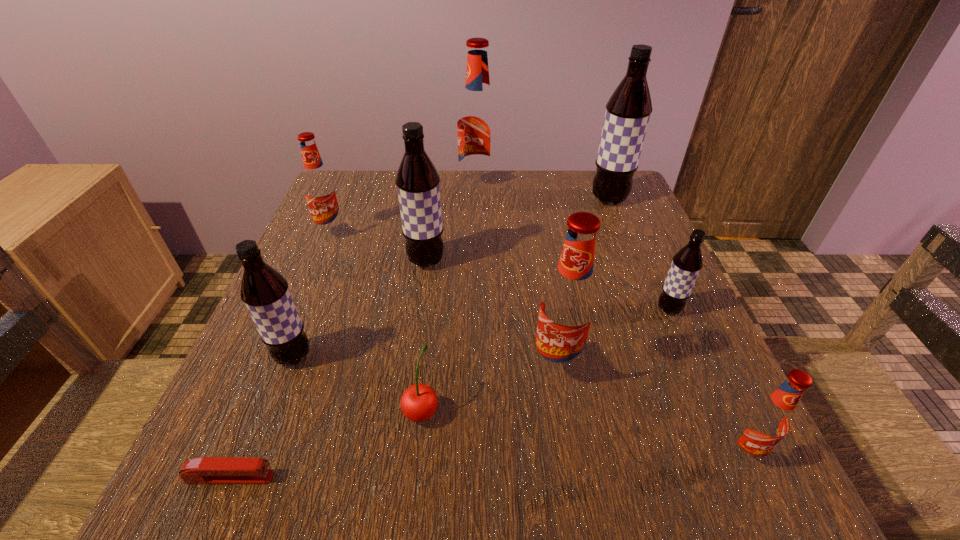
Find the location of `free region located 0.070m on the left of the farthest brown root beer`. free region located 0.070m on the left of the farthest brown root beer is located at coordinates (562, 199).

Identify the location of vacant space located on the back of the third nearest brown root beer. (437, 186).

At what (x,y) coordinates should I click in order to perform the action: click on vacant space located 0.230m on the back of the second biggest red root beer. Please return your answer as a coordinate pair (x, y). Looking at the image, I should click on (540, 263).

You are a GUI agent. You are given a task and a screenshot of the screen. Output one action in this format:
    pyautogui.click(x=<x>, y=<y>)
    Task: Click on the vacant space located on the front of the eighth nearest object
    The height and width of the screenshot is (540, 960).
    Given the screenshot: What is the action you would take?
    pyautogui.click(x=316, y=271)

At what (x,y) coordinates should I click in order to perform the action: click on vacant area located on the right of the second smallest brown root beer. Please return your answer as a coordinate pair (x, y). Looking at the image, I should click on (540, 356).

At what (x,y) coordinates should I click in order to perform the action: click on vacant space situated 0.170m on the back of the fifth farthest object. Please return your answer as a coordinate pair (x, y). Looking at the image, I should click on (641, 246).

At what (x,y) coordinates should I click in order to perform the action: click on free location located on the left of the nearest red root beer. Please return your answer as a coordinate pair (x, y). This screenshot has height=540, width=960. Looking at the image, I should click on (662, 452).

The width and height of the screenshot is (960, 540). I want to click on vacant region located 0.180m on the back of the cherry, so click(x=433, y=309).

Find the location of `free space located 0.140m on the front-facing side of the stapler`. free space located 0.140m on the front-facing side of the stapler is located at coordinates (375, 477).

At what (x,y) coordinates should I click in order to perform the action: click on root beer that is at the near edge. Please return your answer as a coordinate pair (x, y). The height and width of the screenshot is (540, 960). Looking at the image, I should click on (766, 422).